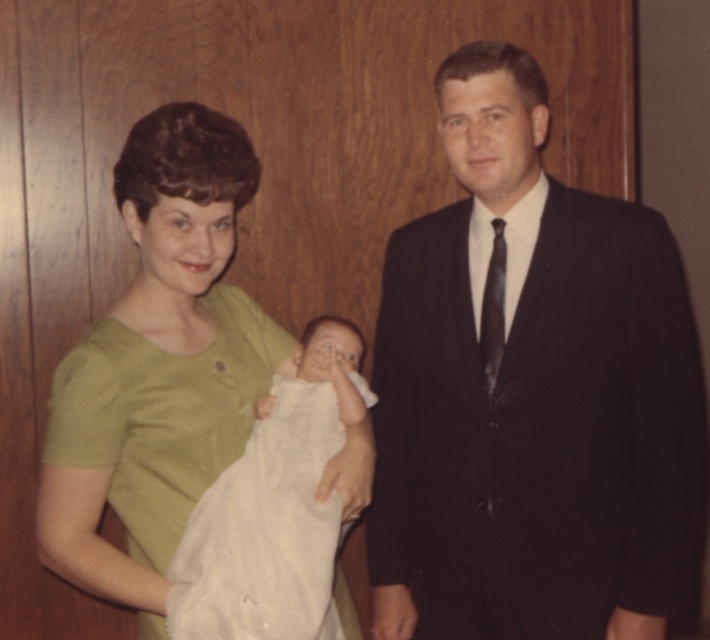
In the family portrait, there is a point marked at coordinates [530,394]. What object is located at this point?

The point at coordinates [530,394] indicates the dark suit at center.

In the family portrait, you notice the dark suit at center and the green matte dress at center. Which one is positioned higher up in the image?

The dark suit at center is located above the green matte dress at center, so it is positioned higher up in the image.